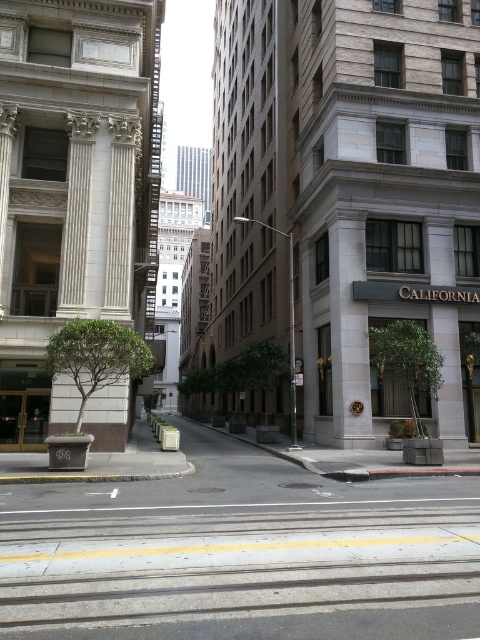
Question: Which object appears farthest from the camera in this image?

Choices:
 (A) metallic street sign at center
 (B) white marble pillar at left

Answer: (A)

Question: Is white marble pillar at left above metallic street sign at center?

Choices:
 (A) no
 (B) yes

Answer: (A)

Question: Does white marble pillar at left appear under metallic street sign at center?

Choices:
 (A) yes
 (B) no

Answer: (A)

Question: Which point is closer to the camera?

Choices:
 (A) (x=121, y=280)
 (B) (x=292, y=371)

Answer: (A)

Question: Can you confirm if white marble pillar at left is positioned to the left of metallic street sign at center?

Choices:
 (A) no
 (B) yes

Answer: (B)

Question: Among these objects, which one is farthest from the camera?

Choices:
 (A) metallic street sign at center
 (B) white marble pillar at left

Answer: (A)